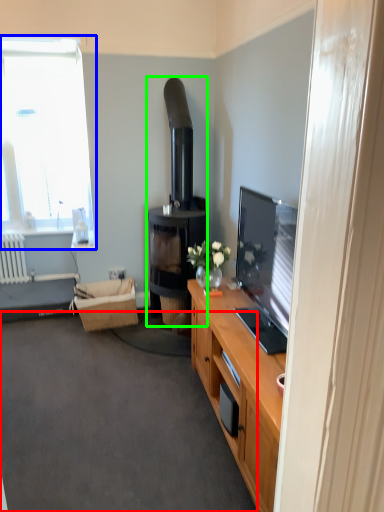
Question: Which object is the closest to the plain (highlighted by a red box)? Choose among these: window (highlighted by a blue box) or fireplace (highlighted by a green box).

Choices:
 (A) window
 (B) fireplace

Answer: (B)